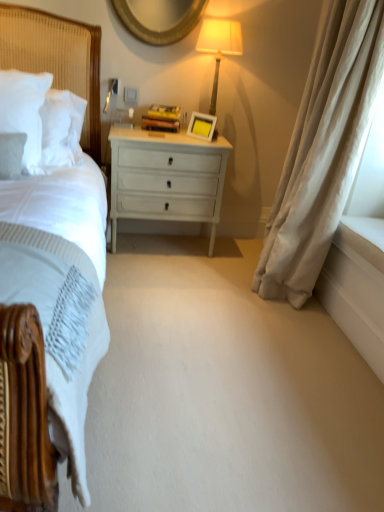
Question: Does white glossy drawer at center lie in front of white soft pillow at left?

Choices:
 (A) yes
 (B) no

Answer: (B)

Question: Considering the relative sizes of white glossy drawer at center and white soft pillow at left in the image provided, is white glossy drawer at center thinner than white soft pillow at left?

Choices:
 (A) no
 (B) yes

Answer: (A)

Question: Is the surface of white glossy drawer at center in direct contact with white soft pillow at left?

Choices:
 (A) yes
 (B) no

Answer: (B)

Question: Is white glossy drawer at center positioned behind white soft pillow at left?

Choices:
 (A) yes
 (B) no

Answer: (A)

Question: Is white glossy drawer at center facing towards white soft pillow at left?

Choices:
 (A) no
 (B) yes

Answer: (A)

Question: From a real-world perspective, is gold textured mirror at upper center above or below white soft pillow at left?

Choices:
 (A) above
 (B) below

Answer: (A)

Question: Is point (127, 10) closer or farther from the camera than point (21, 74)?

Choices:
 (A) farther
 (B) closer

Answer: (A)

Question: Is gold textured mirror at upper center inside or outside of white soft pillow at left?

Choices:
 (A) inside
 (B) outside

Answer: (B)

Question: Is gold textured mirror at upper center bigger or smaller than white soft pillow at left?

Choices:
 (A) big
 (B) small

Answer: (A)

Question: Is point (331, 15) positioned closer to the camera than point (144, 33)?

Choices:
 (A) closer
 (B) farther

Answer: (A)

Question: Would you say beige velvet curtain at right is inside or outside gold textured mirror at upper center?

Choices:
 (A) outside
 (B) inside

Answer: (A)

Question: From a real-world perspective, is beige velvet curtain at right physically located above or below gold textured mirror at upper center?

Choices:
 (A) above
 (B) below

Answer: (B)

Question: In the image, is beige velvet curtain at right positioned in front of or behind gold textured mirror at upper center?

Choices:
 (A) front
 (B) behind

Answer: (A)

Question: In the image, is white soft pillow at left on the left side or the right side of matte cream lampshade at upper right?

Choices:
 (A) right
 (B) left

Answer: (B)

Question: Looking at the image, does white soft pillow at left seem bigger or smaller compared to matte cream lampshade at upper right?

Choices:
 (A) big
 (B) small

Answer: (B)